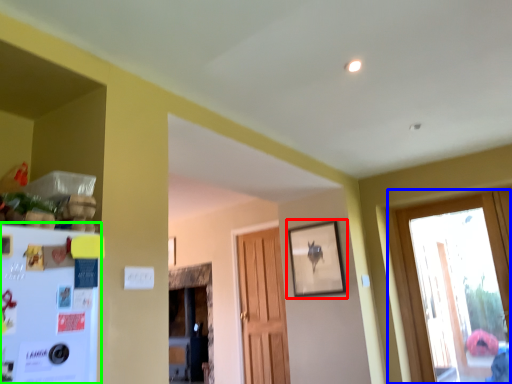
Question: Which is farther away from picture frame (highlighted by a red box)? window (highlighted by a blue box) or fridge (highlighted by a green box)?

Choices:
 (A) window
 (B) fridge

Answer: (A)